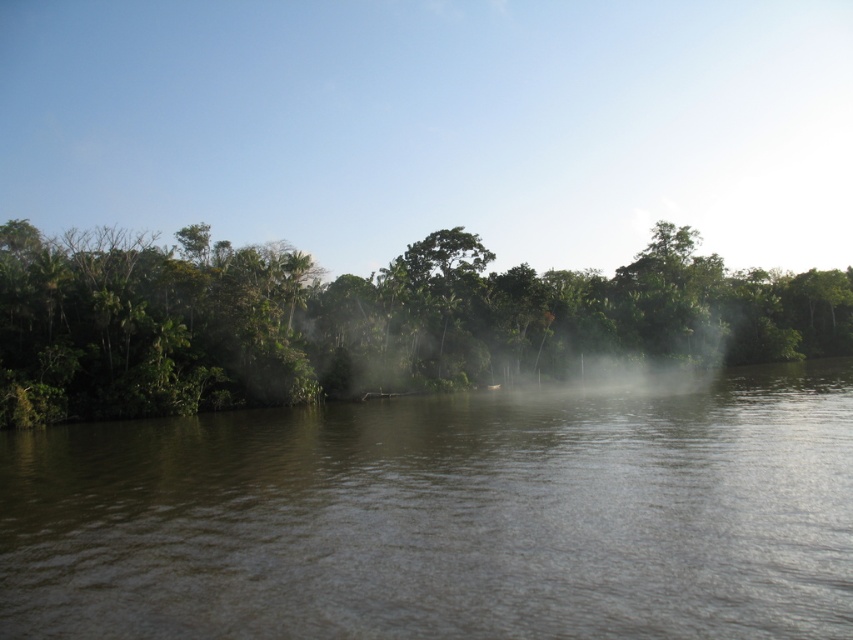
Question: Is brown murky water at center closer to camera compared to green leafy trees at center?

Choices:
 (A) yes
 (B) no

Answer: (A)

Question: Does brown murky water at center lie behind green leafy trees at center?

Choices:
 (A) yes
 (B) no

Answer: (B)

Question: From the image, what is the correct spatial relationship of brown murky water at center in relation to green leafy trees at center?

Choices:
 (A) above
 (B) below

Answer: (B)

Question: Which of the following is the farthest from the observer?

Choices:
 (A) brown murky water at center
 (B) green leafy trees at center

Answer: (B)

Question: Which point is closer to the camera taking this photo?

Choices:
 (A) (228, 611)
 (B) (457, 256)

Answer: (A)

Question: Among these objects, which one is nearest to the camera?

Choices:
 (A) brown murky water at center
 (B) green leafy trees at center

Answer: (A)